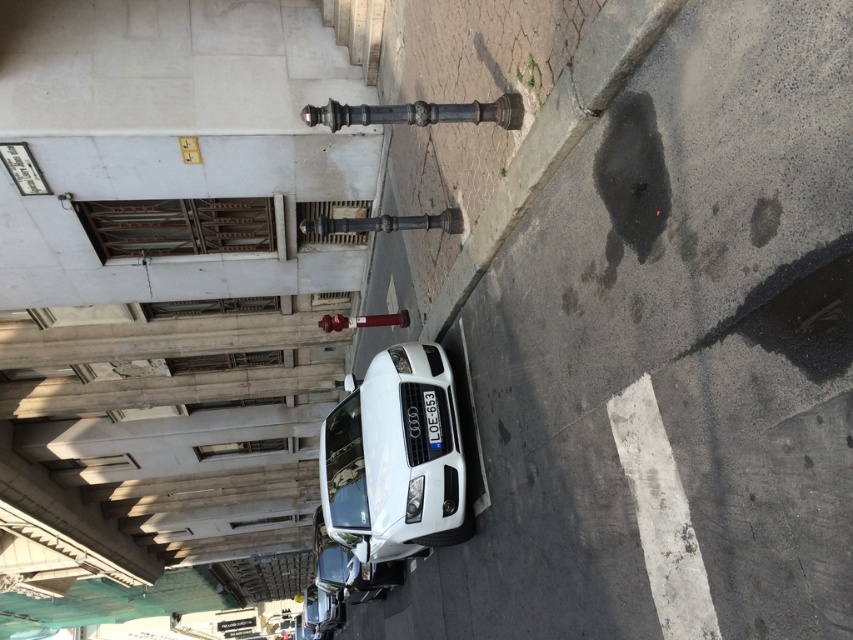
Is white glossy car at center further to camera compared to black plastic license plate at center?

No, white glossy car at center is in front of black plastic license plate at center.

Describe the element at coordinates (393, 460) in the screenshot. The image size is (853, 640). I see `white glossy car at center` at that location.

Find the location of a particular element. Image resolution: width=853 pixels, height=640 pixels. white glossy car at center is located at coordinates [393, 460].